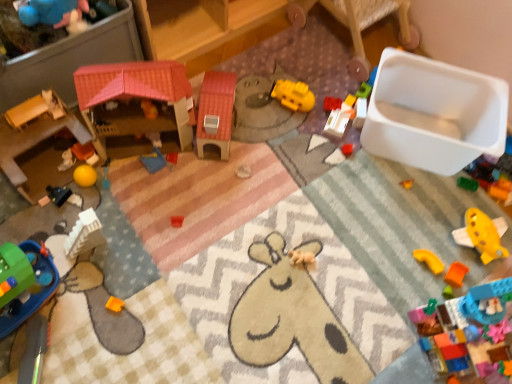
Locate an element on the screen. The height and width of the screenshot is (384, 512). vacant space in between yellow matte plastic toy at center, which is the 8th toy from left to right, and yellow plastic airplane at lower right, arranged as the 15th toy when viewed from the left is located at coordinates (386, 181).